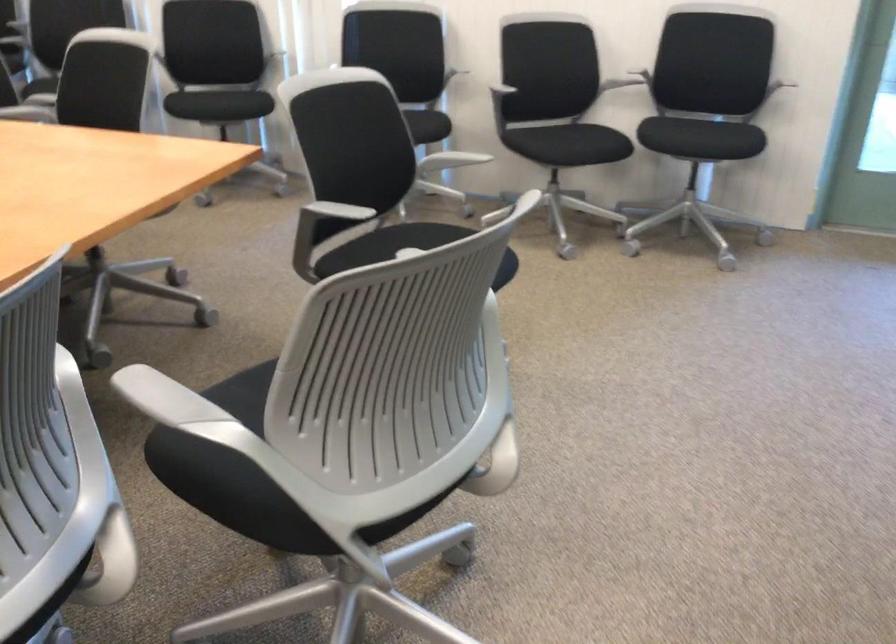
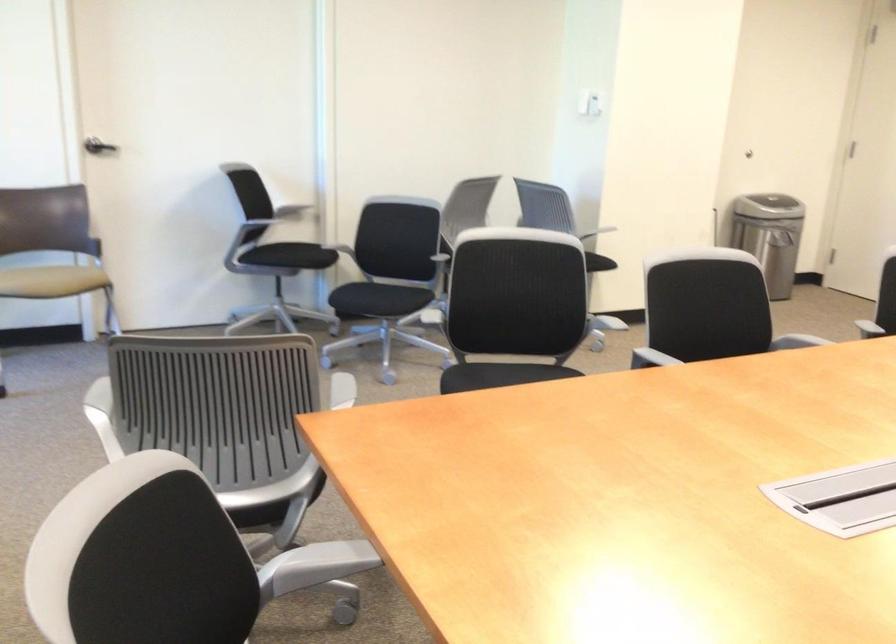
The point at (403, 381) is marked in the first image. Where is the corresponding point in the second image?

(513, 307)